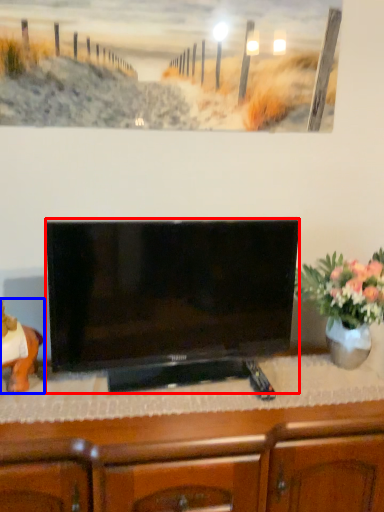
Question: Which point is further to the camera, television (highlighted by a red box) or animal (highlighted by a blue box)?

Choices:
 (A) television
 (B) animal

Answer: (B)